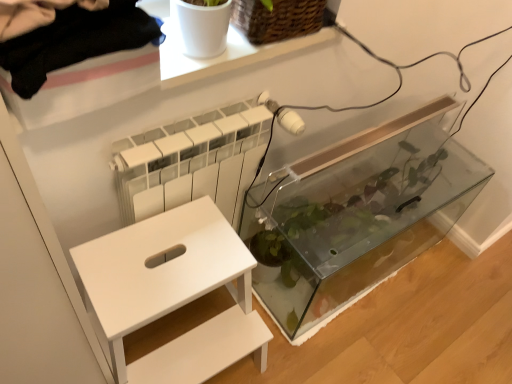
Find the location of a particular element. The image size is (512, 384). vacant space to the right of transparent glass tank at center is located at coordinates (453, 301).